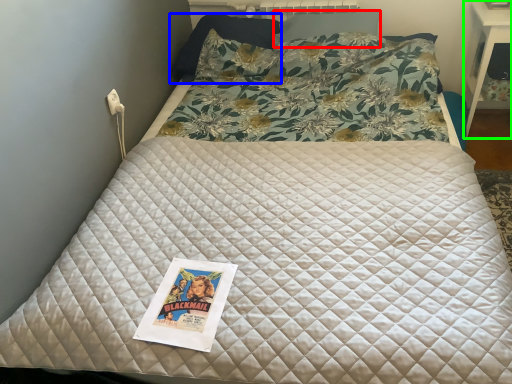
Question: Which is farther away from pillow (highlighted by a red box)? pillow (highlighted by a blue box) or table (highlighted by a green box)?

Choices:
 (A) pillow
 (B) table

Answer: (B)